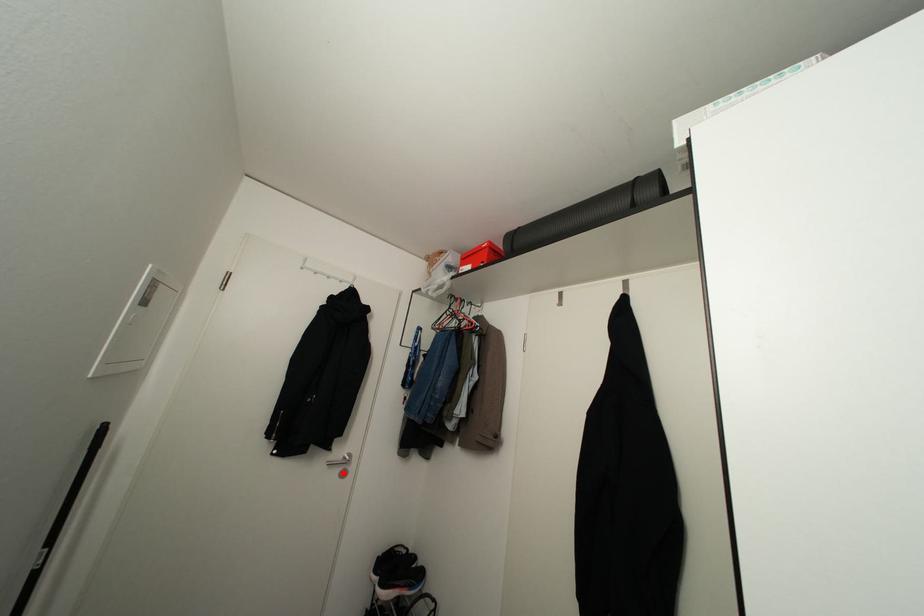
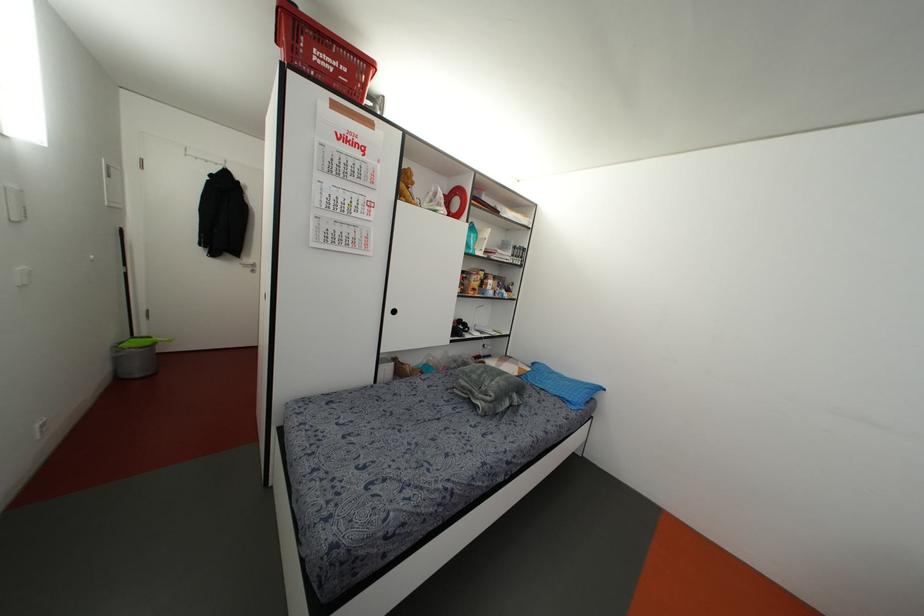
Question: I am providing you with two images of the same scene from different viewpoints. A red point is shown in image1. For the corresponding object point in image2, is it positioned nearer or farther from the camera?

Choices:
 (A) Nearer
 (B) Farther

Answer: (A)